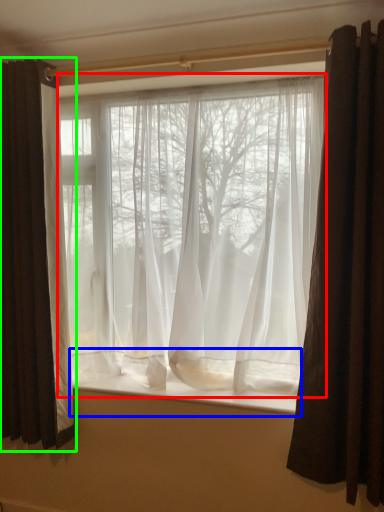
Question: Which object is the closest to the curtain (highlighted by a red box)? Choose among these: window sill (highlighted by a blue box) or curtain (highlighted by a green box).

Choices:
 (A) window sill
 (B) curtain

Answer: (B)